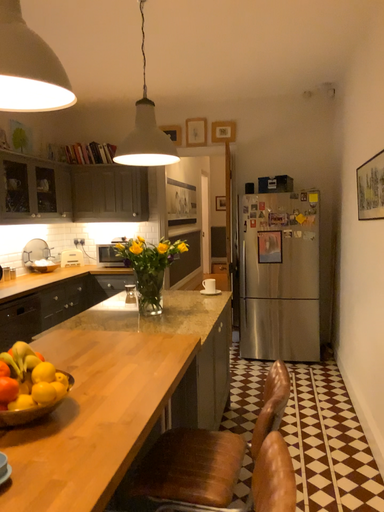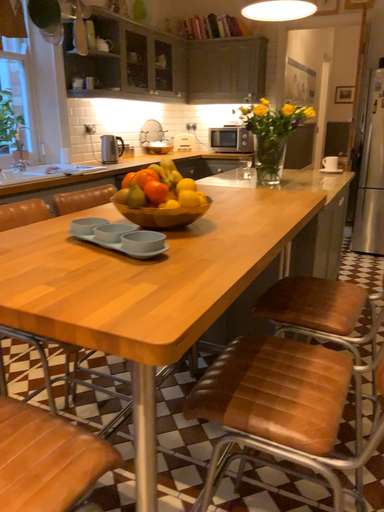
Question: Which way did the camera rotate in the video?

Choices:
 (A) rotated left
 (B) rotated right

Answer: (A)